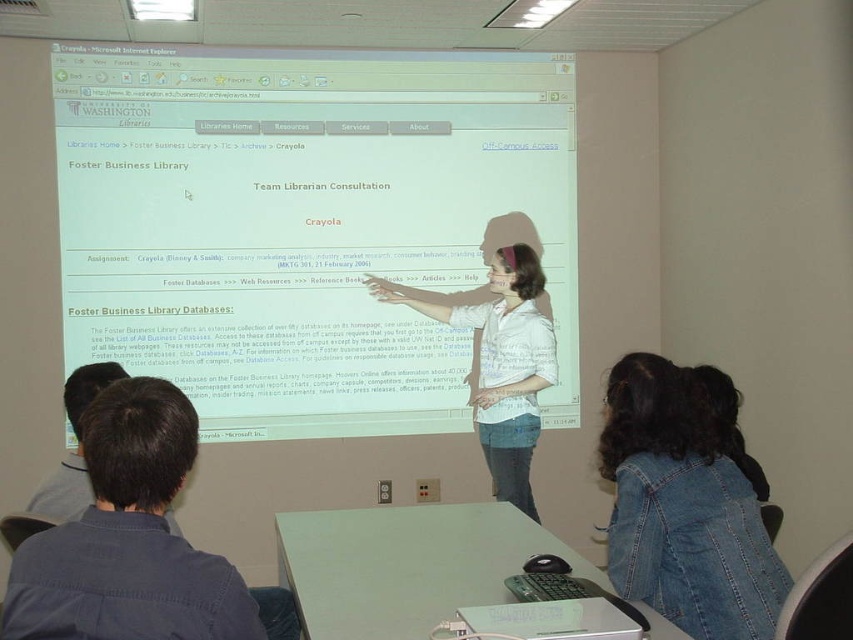
Is white glossy projection screen at upper center wider than white striped shirt at center?

Yes.

Who is more distant from viewer, (x=152, y=188) or (x=463, y=324)?

Point (x=152, y=188)

Between point (252, 188) and point (509, 380), which one is positioned in front?

Point (509, 380) is in front.

Identify the location of white glossy projection screen at upper center. This screenshot has width=853, height=640. (306, 225).

Who is shorter, white glossy projection screen at upper center or denim jacket at lower right?

Standing shorter between the two is denim jacket at lower right.

Which is more to the left, white glossy projection screen at upper center or denim jacket at lower right?

Positioned to the left is white glossy projection screen at upper center.

Does point (207, 244) come in front of point (631, 420)?

No, it is not.

Where is `white glossy projection screen at upper center`? The image size is (853, 640). white glossy projection screen at upper center is located at coordinates (306, 225).

Who is higher up, denim jacket at lower right or white striped shirt at center?

Positioned higher is white striped shirt at center.

How far apart are denim jacket at lower right and white striped shirt at center?

5.37 feet

Is point (654, 456) farther from camera compared to point (482, 401)?

No, (654, 456) is closer to viewer.

At what (x,y) coordinates should I click in order to perform the action: click on denim jacket at lower right. Please return your answer as a coordinate pair (x, y). Looking at the image, I should click on (682, 508).